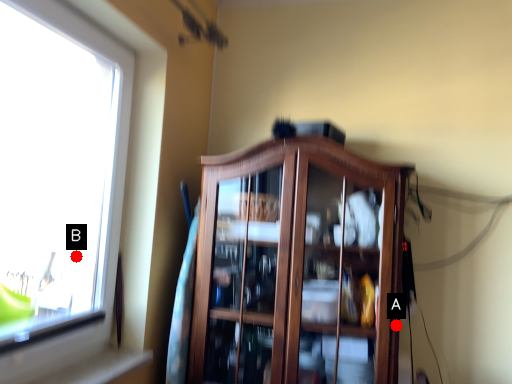
Question: Two points are circled on the image, labeled by A and B beside each circle. Which of the following is the farthest from the observer?

Choices:
 (A) A is further
 (B) B is further

Answer: (B)